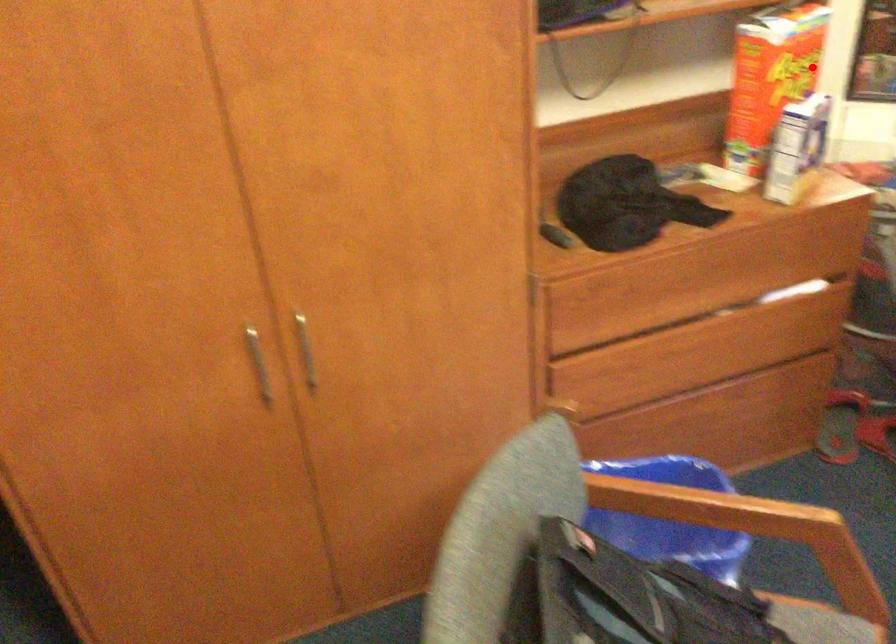
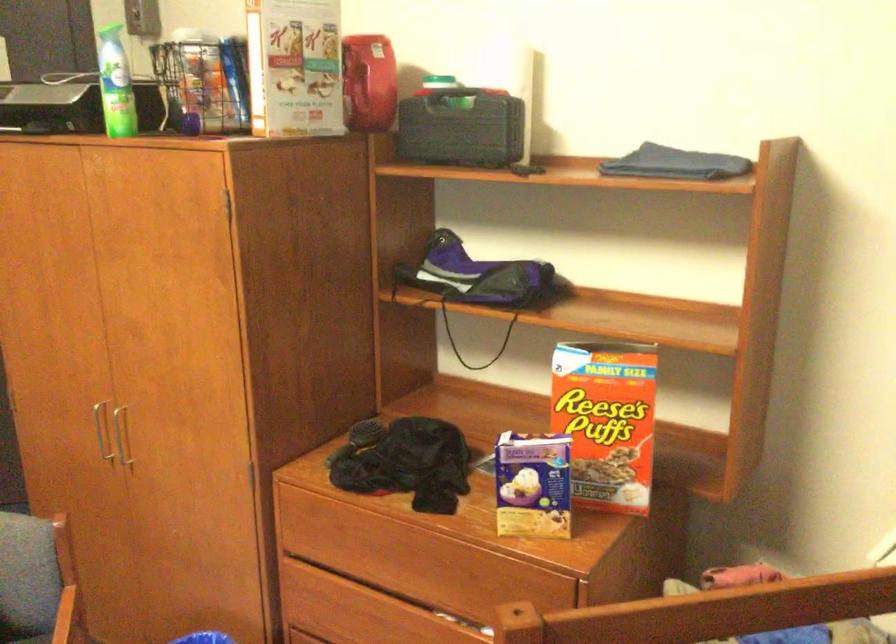
The point at the highlighted location is marked in the first image. Where is the corresponding point in the second image?

(606, 420)